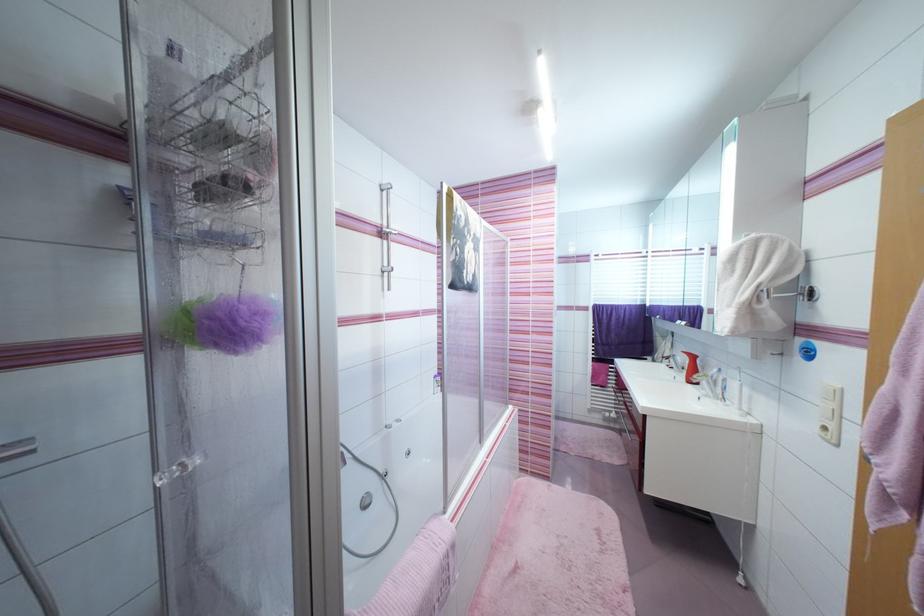
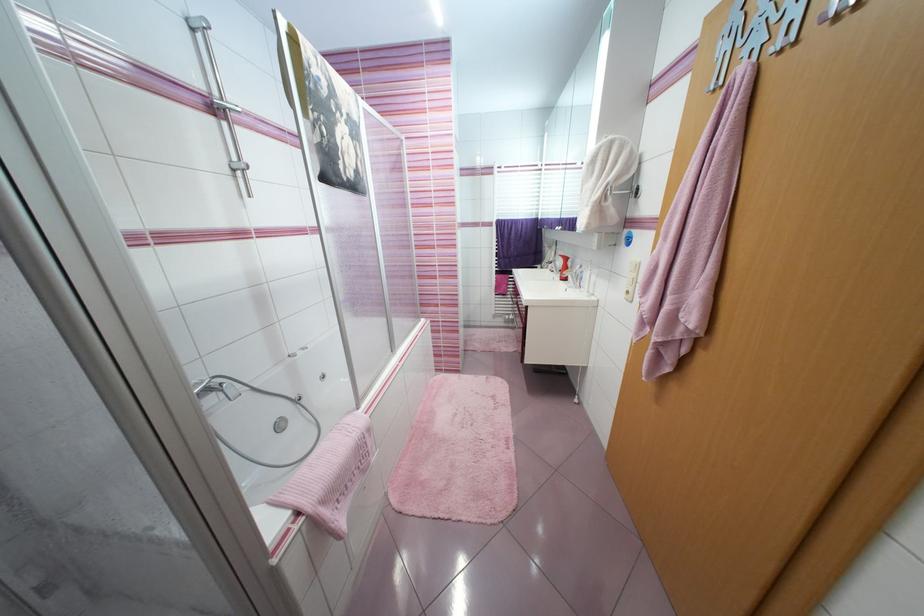
Find the pixel in the second image that matches [391,275] in the first image.

(245, 175)